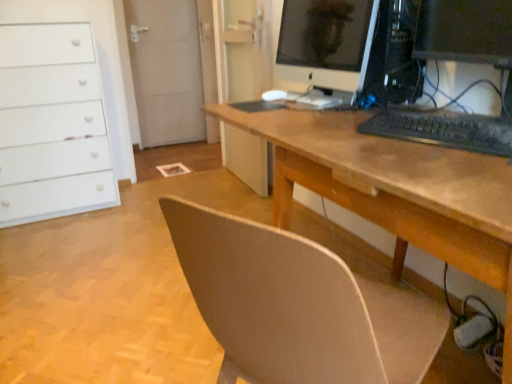
Find the location of `vacant area that is situated to the right of white matte chest of drawers at left`. vacant area that is situated to the right of white matte chest of drawers at left is located at coordinates pyautogui.click(x=136, y=205).